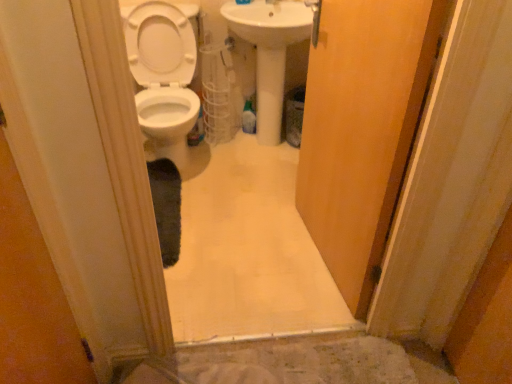
This screenshot has width=512, height=384. I want to click on unoccupied area in front of white glossy sink at center, so click(x=262, y=180).